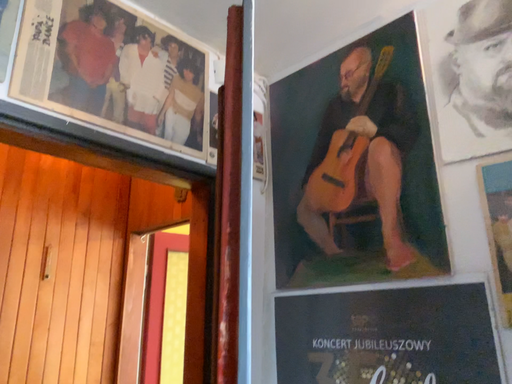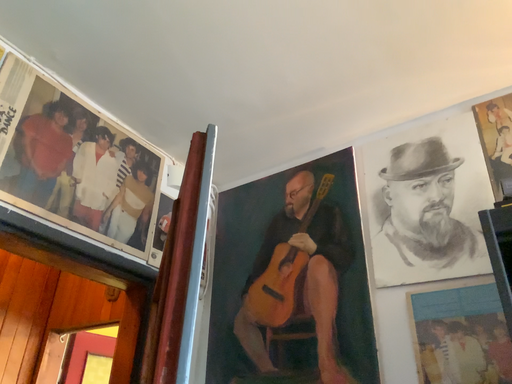
Question: How did the camera likely rotate when shooting the video?

Choices:
 (A) rotated upward
 (B) rotated downward

Answer: (A)